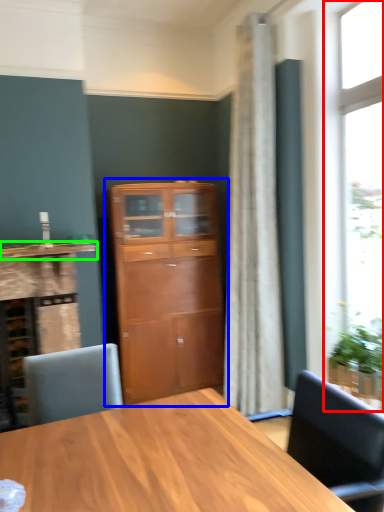
Question: Which object is the closest to the window (highlighted by a red box)? Choose among these: cupboard (highlighted by a blue box) or counter top (highlighted by a green box).

Choices:
 (A) cupboard
 (B) counter top

Answer: (A)